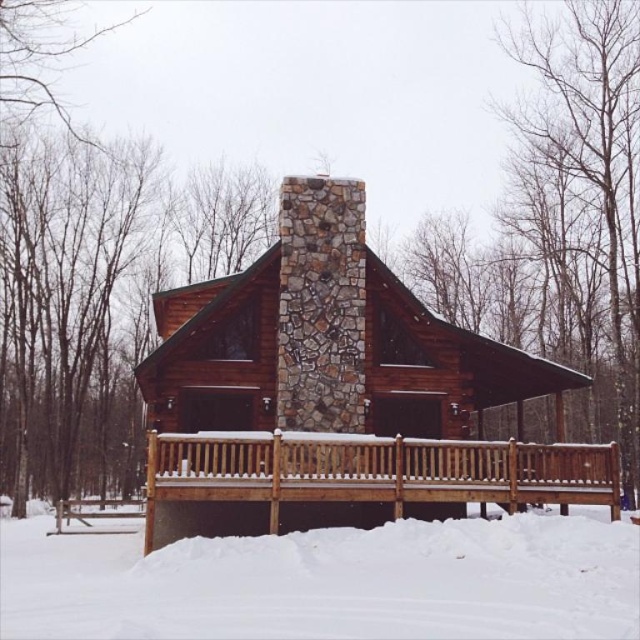
You are a delivery person trying to reach the cabin door. You see the white fluffy snow at lower center and the brown wooden deck at lower center. Which surface is lower and more accessible for you to step onto?

The white fluffy snow at lower center is lower than the brown wooden deck at lower center, making it more accessible for stepping onto.

You are standing at the entrance of the rustic log cabin and want to check the snow depth at the point marked by point (x=330, y=580). Is this point located on the porch floor or the ground around the cabin?

The point (x=330, y=580) corresponds to the white fluffy snow at lower center, which is on the porch floor.